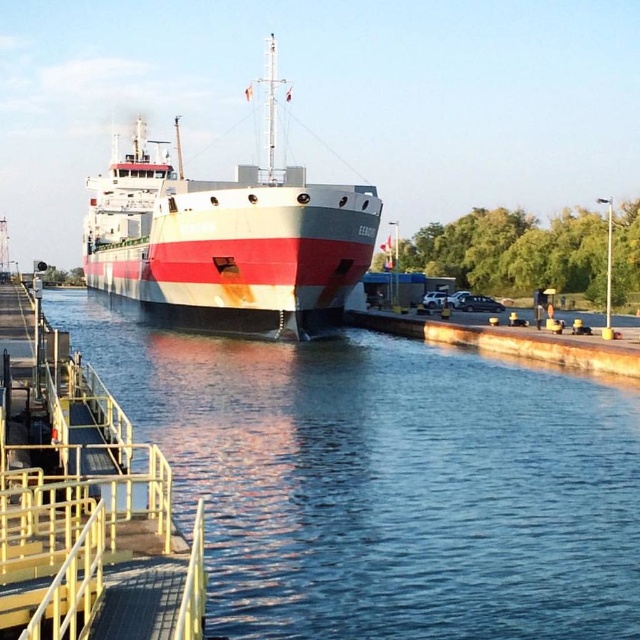
Which of these two, smooth water at lower center or rustic metal ship at center, stands taller?

rustic metal ship at center

Which of these two, smooth water at lower center or rustic metal ship at center, stands shorter?

With less height is smooth water at lower center.

Between point (275, 573) and point (227, 241), which one is positioned in front?

Point (275, 573) is more forward.

This screenshot has width=640, height=640. Identify the location of smooth water at lower center. [x=384, y=481].